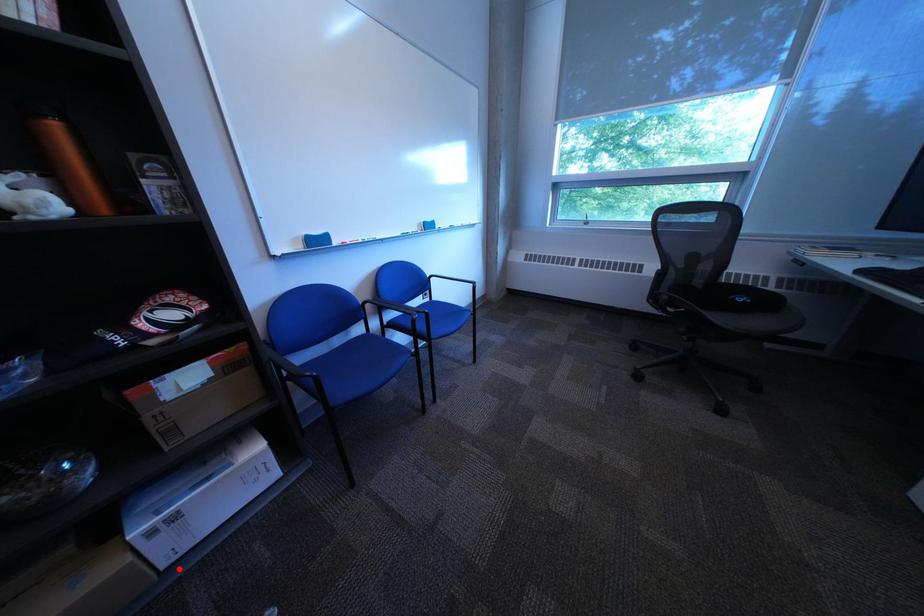
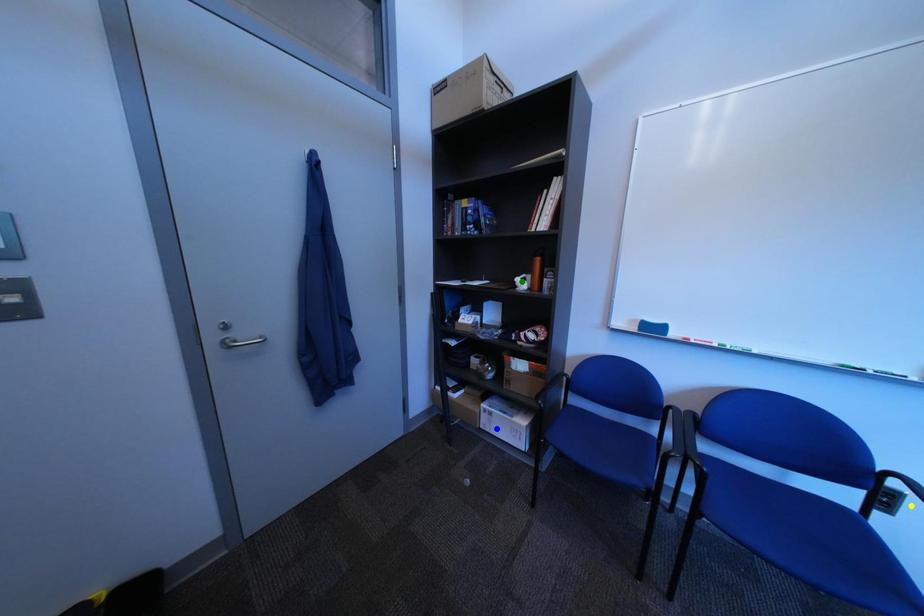
Question: I am providing you with two images of the same scene from different viewpoints. A red point is marked on the first image. You are given multiple points on the second image. Which point in image 2 is actually the same real-world point as the red point in image 1?

Choices:
 (A) green point
 (B) yellow point
 (C) blue point

Answer: (C)